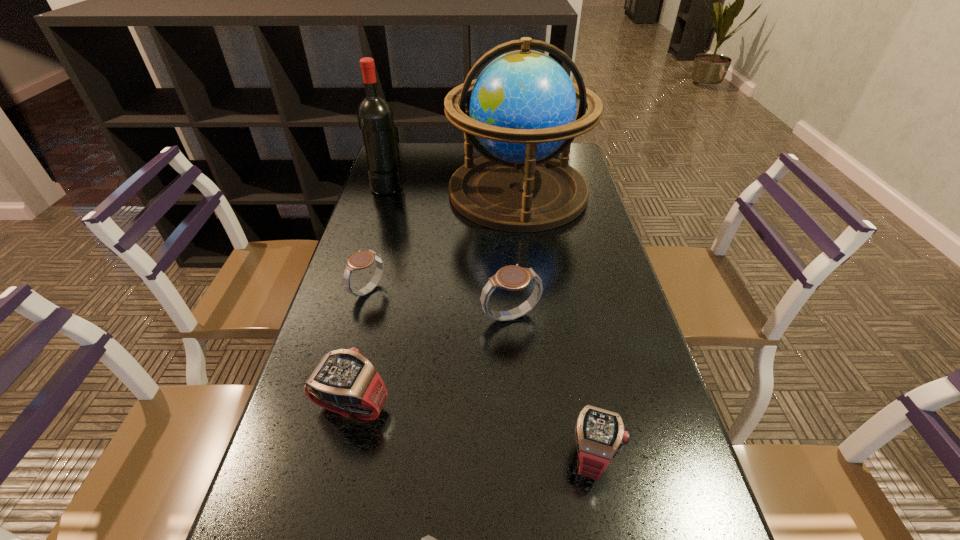
The width and height of the screenshot is (960, 540). I want to click on vacant space at the right edge of the desktop, so click(x=619, y=517).

Locate an element on the screen. This screenshot has height=540, width=960. vacant space at the far right corner of the desktop is located at coordinates (582, 168).

Where is `vacant point located between the globe and the rightmost gray watch`? This screenshot has height=540, width=960. vacant point located between the globe and the rightmost gray watch is located at coordinates (515, 254).

The height and width of the screenshot is (540, 960). I want to click on free space between the second biggest gray watch and the globe, so click(443, 241).

In order to click on free area in between the rightmost watch and the globe in this screenshot , I will do `click(556, 323)`.

Locate an element on the screen. This screenshot has width=960, height=540. vacant region between the left red watch and the rightmost watch is located at coordinates (472, 430).

At what (x,y) coordinates should I click in order to perform the action: click on free spot between the smaller red watch and the leftmost gray watch. Please return your answer as a coordinate pair (x, y). This screenshot has height=540, width=960. Looking at the image, I should click on (481, 373).

I want to click on vacant area that lies between the right red watch and the second watch from right to left, so click(552, 385).

Identify the location of the third closest object to the right red watch. (345, 381).

Point out which object is positioned as the fourth nearest to the left red watch. Please provide its 2D coordinates. Your answer should be formatted as a tuple, i.e. [(x, y)], where the tuple contains the x and y coordinates of a point satisfying the conditions above.

[(600, 434)]